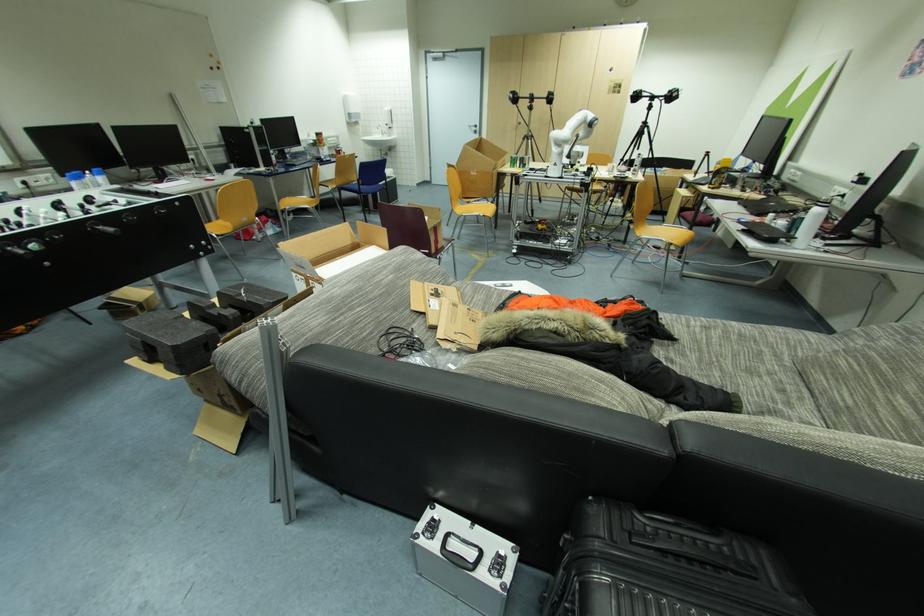
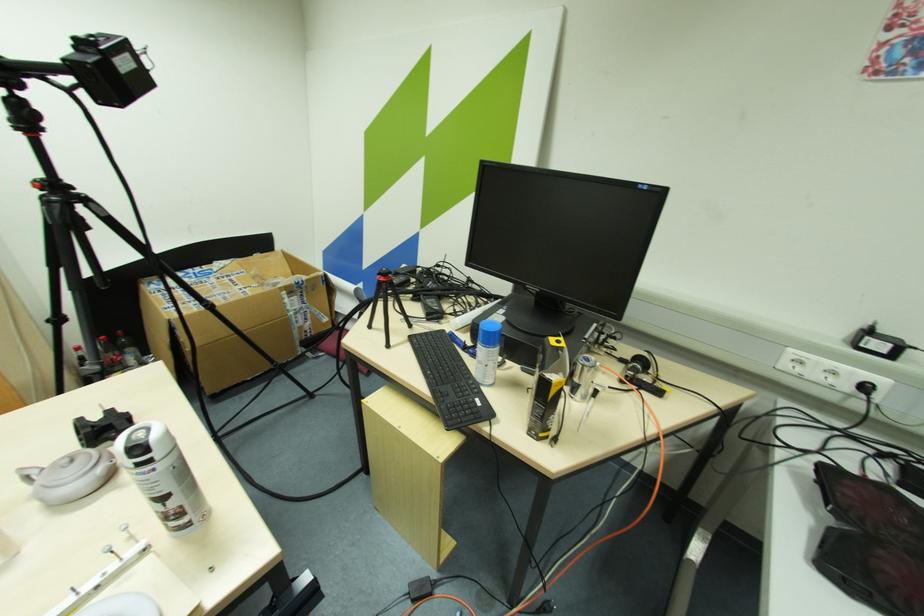
The point at (638, 167) is marked in the first image. Where is the corresponding point in the second image?

(164, 500)